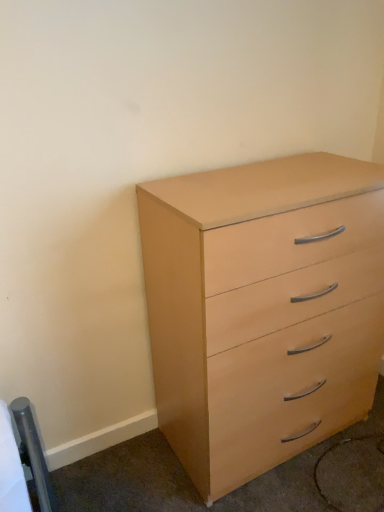
Find the location of a particular element. Image resolution: width=384 pixels, height=512 pixels. blank space situated above light wood chest of drawers at right (from a real-world perspective) is located at coordinates (270, 178).